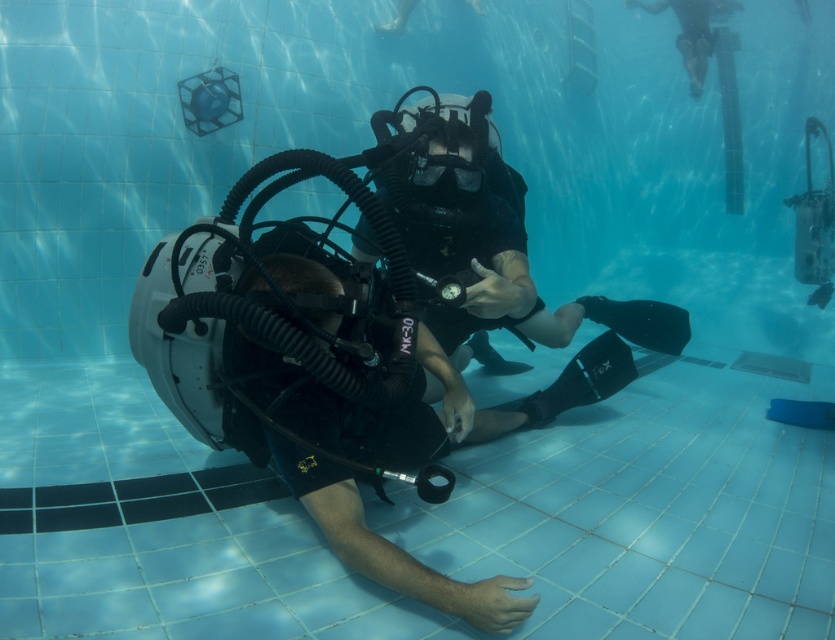
Which is behind, point (692, 42) or point (449, 157)?

The point (692, 42) is behind.

You are a GUI agent. You are given a task and a screenshot of the screen. Output one action in this format:
    pyautogui.click(x=<x>, y=<y>)
    Task: Click on the smooth skin at upper right
    Image resolution: width=835 pixels, height=640 pixels.
    Given the screenshot: What is the action you would take?
    pyautogui.click(x=692, y=32)